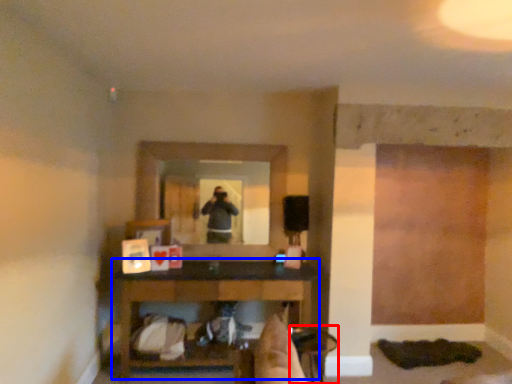
Question: Which object appears closest to the camera in this image, chair (highlighted by a red box) or table (highlighted by a blue box)?

Choices:
 (A) chair
 (B) table

Answer: (A)